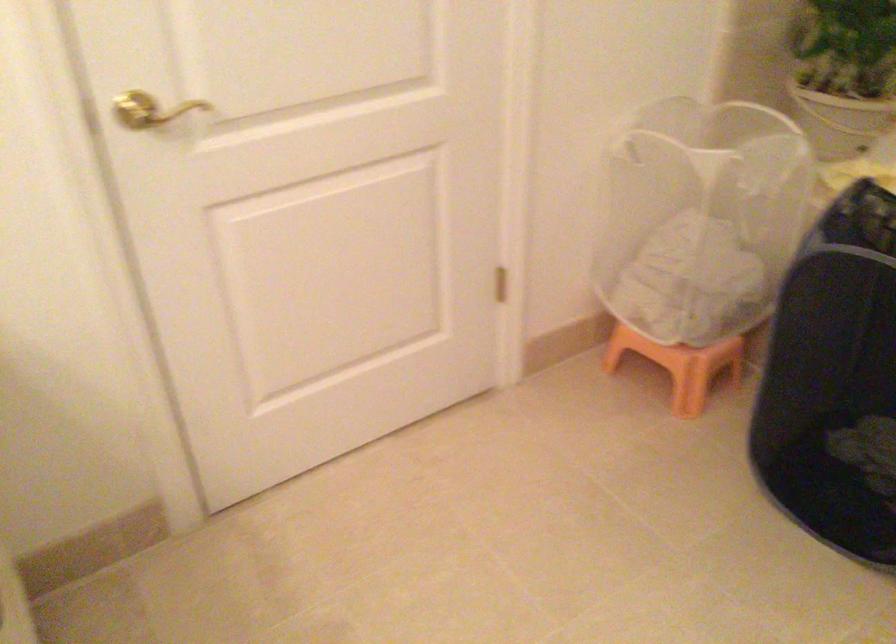
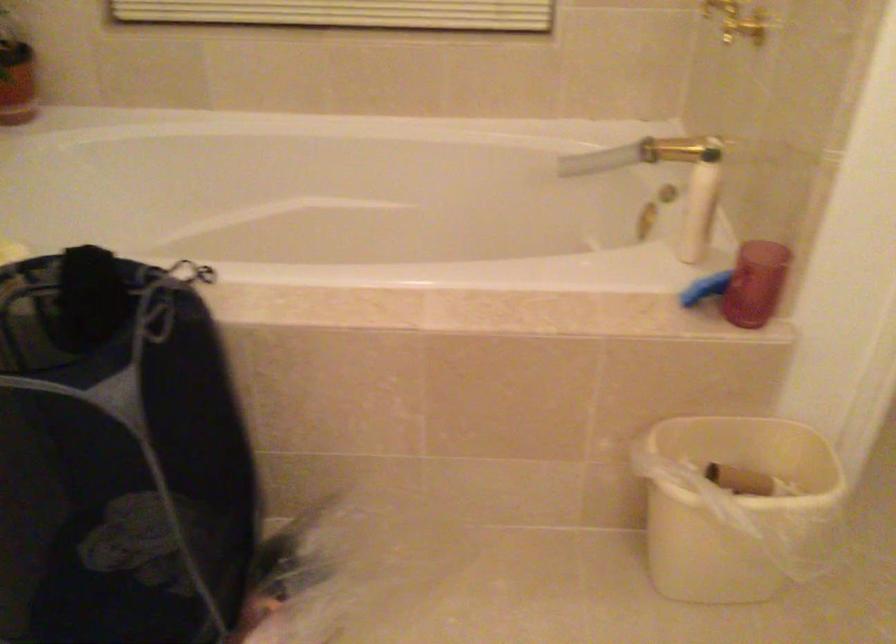
Question: The camera is either moving clockwise (left) or counter-clockwise (right) around the object. The first image is from the beginning of the video and the second image is from the end. Is the camera moving left or right when shooting the video?

Choices:
 (A) Left
 (B) Right

Answer: (A)